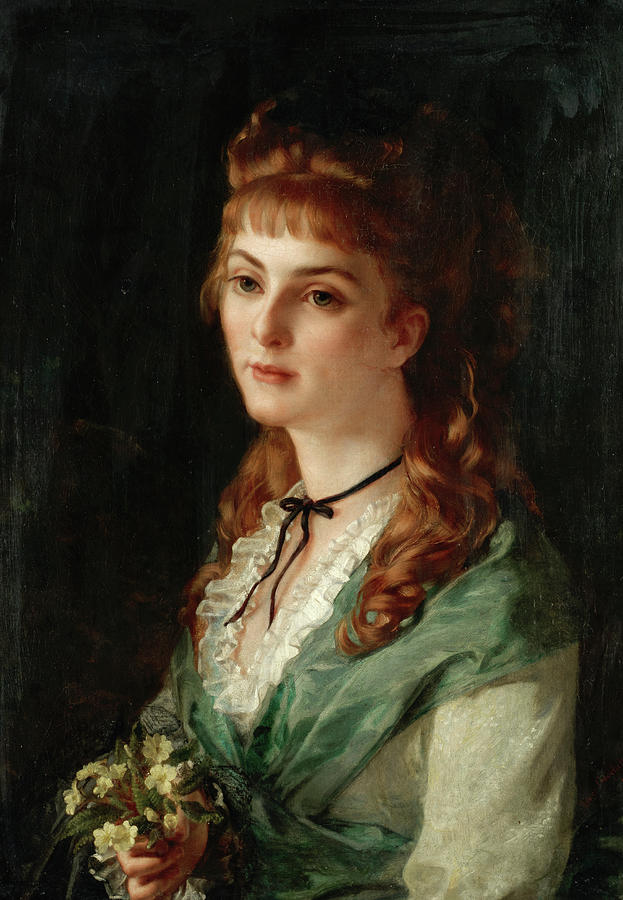
Where is `artwork`? This screenshot has height=900, width=623. artwork is located at coordinates (358, 718).